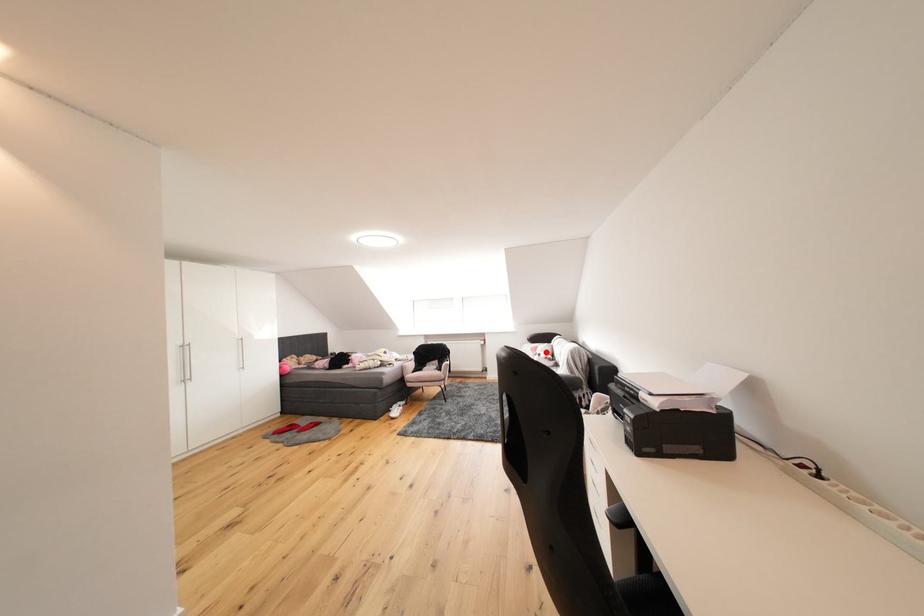
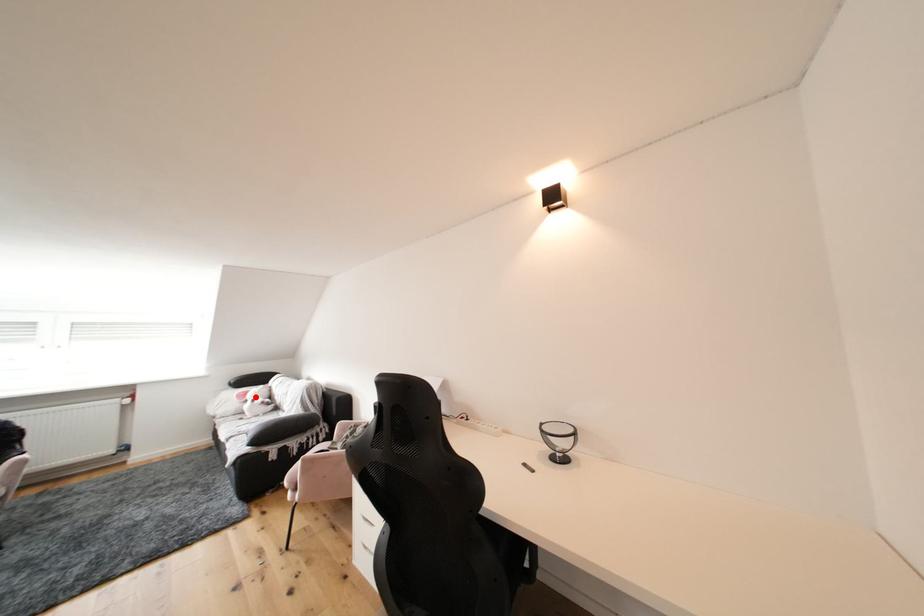
I am providing you with two images of the same scene from different viewpoints. A red point is marked on the first image and another point is marked on the second image. Is the marked point in image1 the same physical position as the marked point in image2?

Yes